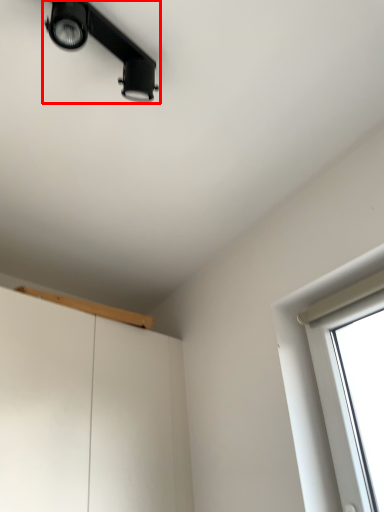
Question: From the image's perspective, what is the correct spatial relationship of lamp (annotated by the red box) in relation to window sill?

Choices:
 (A) above
 (B) below

Answer: (A)